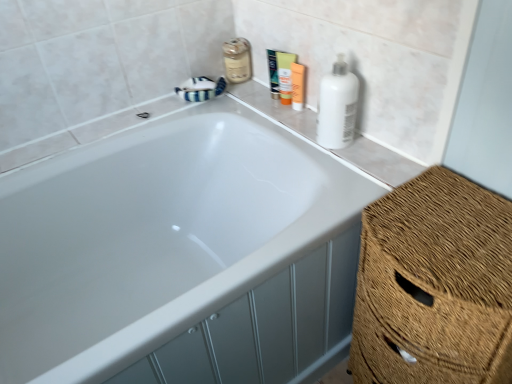
Question: Does white glossy bathtub at upper center lie behind green plastic tube at upper center, which is the 3th toiletry in right-to-left order?

Choices:
 (A) yes
 (B) no

Answer: (B)

Question: Does white glossy bathtub at upper center have a lesser height compared to green plastic tube at upper center, which is the 3th toiletry in right-to-left order?

Choices:
 (A) no
 (B) yes

Answer: (A)

Question: From a real-world perspective, is white glossy bathtub at upper center physically above green plastic tube at upper center, positioned as the first toiletry in left-to-right order?

Choices:
 (A) no
 (B) yes

Answer: (A)

Question: Does white glossy bathtub at upper center turn towards green plastic tube at upper center, which is the 3th toiletry in right-to-left order?

Choices:
 (A) no
 (B) yes

Answer: (A)

Question: Can you confirm if white glossy bathtub at upper center is smaller than green plastic tube at upper center, which is the 3th toiletry in right-to-left order?

Choices:
 (A) yes
 (B) no

Answer: (B)

Question: In the image, is green plastic tube at upper center, which is the 3th toiletry in right-to-left order, on the left side or the right side of orange matte lotion at upper center, which is counted as the 1th toiletry, starting from the right?

Choices:
 (A) right
 (B) left

Answer: (B)

Question: Do you think green plastic tube at upper center, which is the 3th toiletry in right-to-left order, is within orange matte lotion at upper center, which is the 3th toiletry in left-to-right order, or outside of it?

Choices:
 (A) outside
 (B) inside

Answer: (A)

Question: Based on their sizes in the image, would you say green plastic tube at upper center, which is the 3th toiletry in right-to-left order, is bigger or smaller than orange matte lotion at upper center, which is the 3th toiletry in left-to-right order?

Choices:
 (A) big
 (B) small

Answer: (A)

Question: From the image's perspective, relative to orange matte lotion at upper center, which is the 3th toiletry in left-to-right order, is green plastic tube at upper center, which is the 3th toiletry in right-to-left order, above or below?

Choices:
 (A) above
 (B) below

Answer: (A)

Question: Is orange matte lotion at upper center, which is counted as the 1th toiletry, starting from the right, in front of or behind green plastic tube at upper center, positioned as the first toiletry in left-to-right order, in the image?

Choices:
 (A) behind
 (B) front

Answer: (B)

Question: Visually, is orange matte lotion at upper center, which is counted as the 1th toiletry, starting from the right, positioned to the left or to the right of green plastic tube at upper center, positioned as the first toiletry in left-to-right order?

Choices:
 (A) right
 (B) left

Answer: (A)

Question: Is point (301, 67) positioned closer to the camera than point (274, 69)?

Choices:
 (A) farther
 (B) closer

Answer: (B)

Question: Considering the positions of orange matte lotion at upper center, which is the 3th toiletry in left-to-right order, and green plastic tube at upper center, positioned as the first toiletry in left-to-right order, in the image, is orange matte lotion at upper center, which is the 3th toiletry in left-to-right order, wider or thinner than green plastic tube at upper center, positioned as the first toiletry in left-to-right order,?

Choices:
 (A) thin
 (B) wide

Answer: (B)

Question: From the image's perspective, is white glossy bathtub at upper center located above or below white matte bottle at upper right?

Choices:
 (A) below
 (B) above

Answer: (A)

Question: Is white glossy bathtub at upper center in front of or behind white matte bottle at upper right in the image?

Choices:
 (A) front
 (B) behind

Answer: (A)